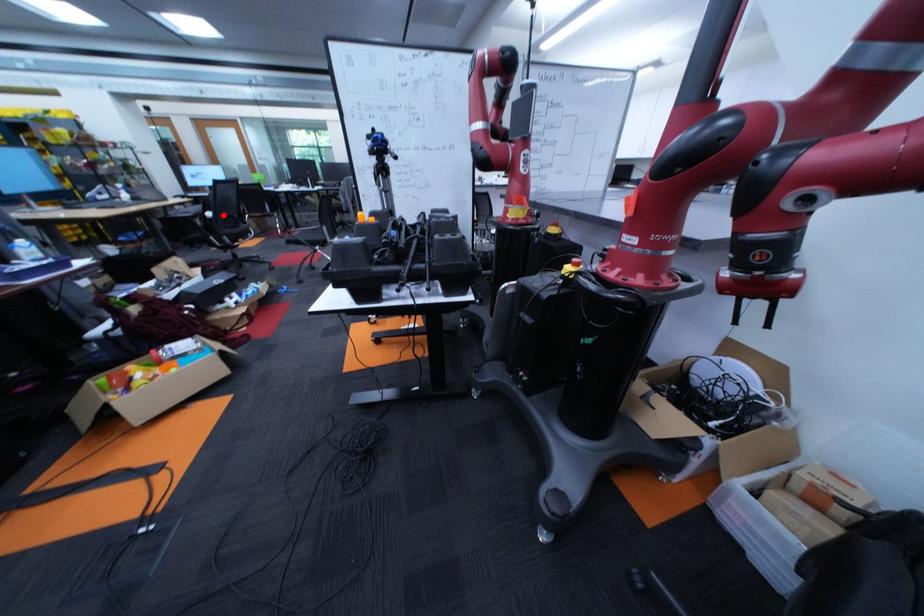
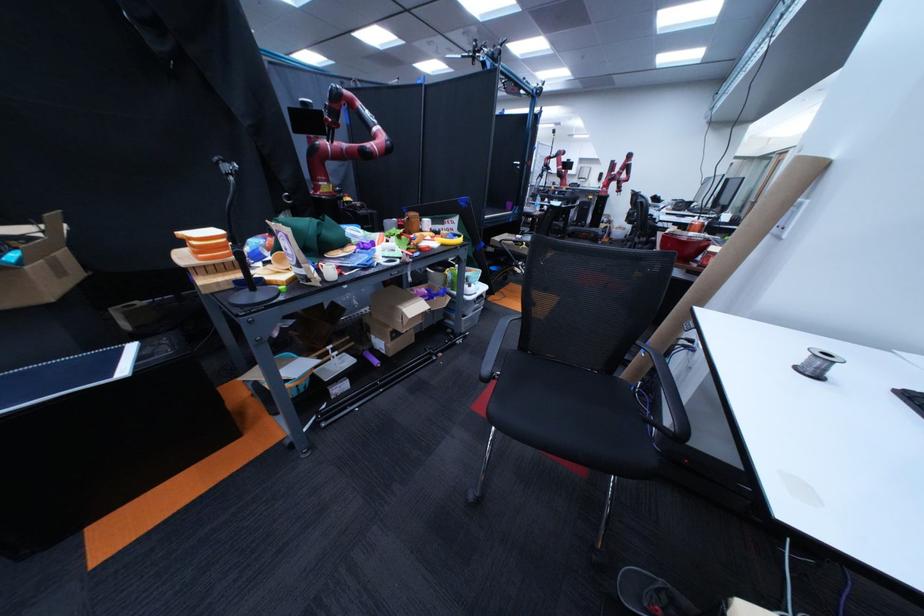
Question: I am providing you with two images of the same scene from different viewpoints. A red point is marked on the first image. Is the red point's position out of view in image 2?

Choices:
 (A) Yes
 (B) No

Answer: (A)